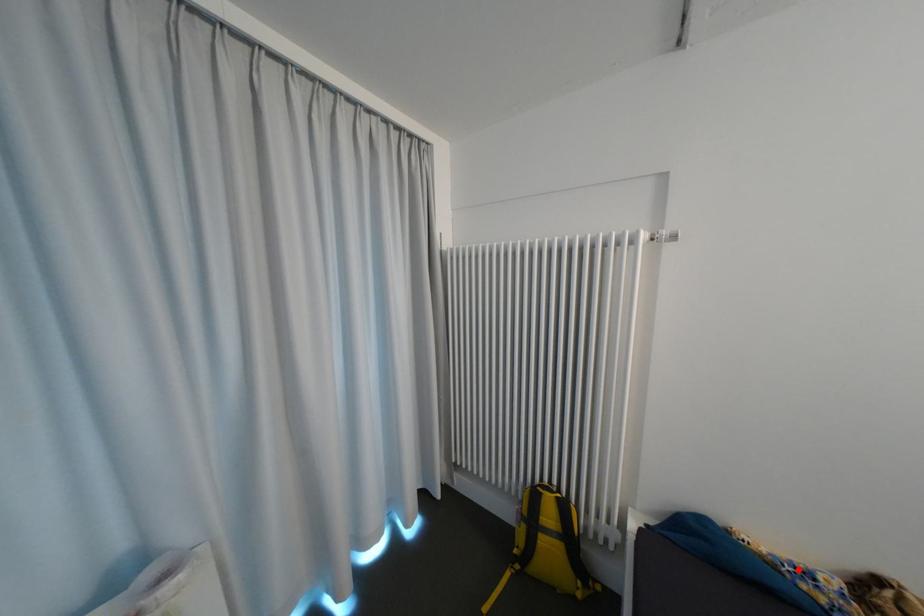
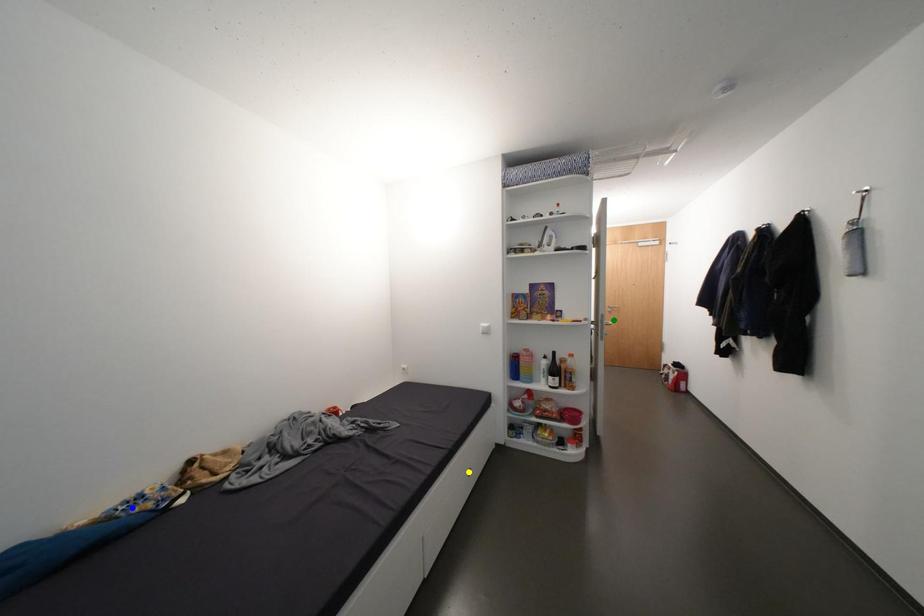
Question: I am providing you with two images of the same scene from different viewpoints. A red point is marked on the first image. You are given multiple points on the second image. Which spot in image 2 lines up with the point in image 1?

Choices:
 (A) green point
 (B) yellow point
 (C) blue point

Answer: (C)